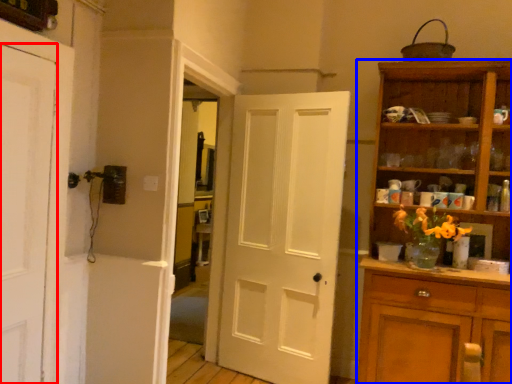
Question: Which point is further to the camera, door (highlighted by a red box) or cupboard (highlighted by a blue box)?

Choices:
 (A) door
 (B) cupboard

Answer: (B)